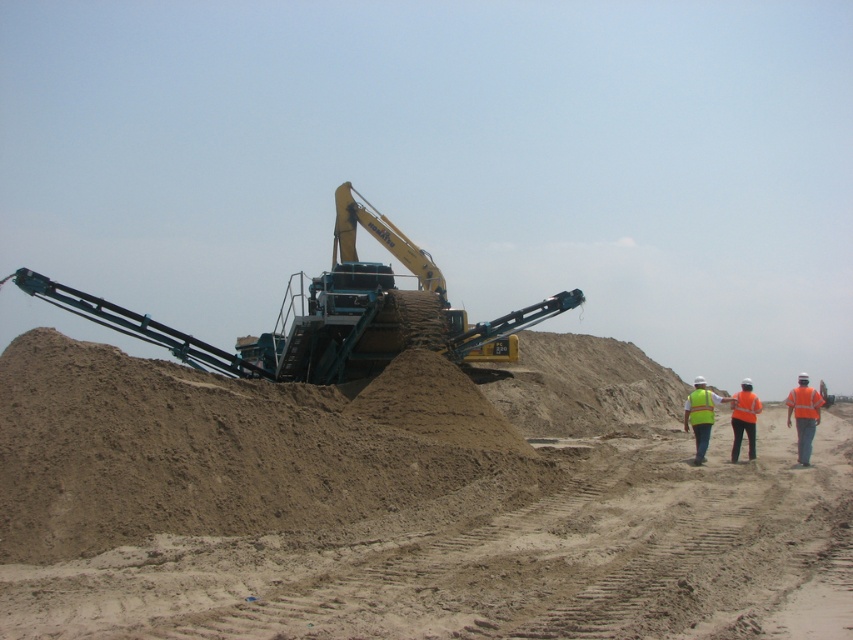
From the picture: Between brown sandy dirt at center and high visibility vest at center, which one is positioned higher?

brown sandy dirt at center is higher up.

Does brown sandy dirt at center have a larger size compared to high visibility vest at center?

Indeed, brown sandy dirt at center has a larger size compared to high visibility vest at center.

Which is behind, point (77, 522) or point (701, 440)?

Point (701, 440)

Locate an element on the screen. brown sandy dirt at center is located at coordinates (403, 502).

Describe the element at coordinates (804, 416) in the screenshot. The width and height of the screenshot is (853, 640). I see `orange reflective vest at right` at that location.

Is point (798, 385) less distant than point (730, 403)?

No, (798, 385) is further to viewer.

Where is `orange reflective vest at right`? The height and width of the screenshot is (640, 853). orange reflective vest at right is located at coordinates (804, 416).

Describe the element at coordinates (335, 314) in the screenshot. The height and width of the screenshot is (640, 853). I see `yellow metallic excavator at center` at that location.

Is yellow metallic excavator at center thinner than orange reflective vest at right?

Correct, yellow metallic excavator at center's width is less than orange reflective vest at right's.

Where is `yellow metallic excavator at center`? This screenshot has height=640, width=853. yellow metallic excavator at center is located at coordinates (335, 314).

Find the location of `yellow metallic excavator at center`. yellow metallic excavator at center is located at coordinates (335, 314).